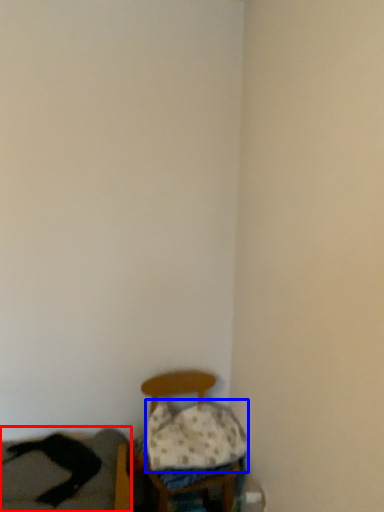
Question: Which point is closer to the camera, couch (highlighted by a red box) or pillow (highlighted by a blue box)?

Choices:
 (A) couch
 (B) pillow

Answer: (A)